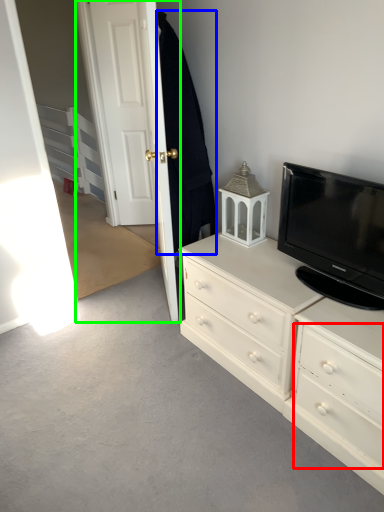
Question: Based on their relative distances, which object is farther from drawer (highlighted by a red box)? Choose from robe (highlighted by a blue box) and door (highlighted by a green box).

Choices:
 (A) robe
 (B) door

Answer: (B)